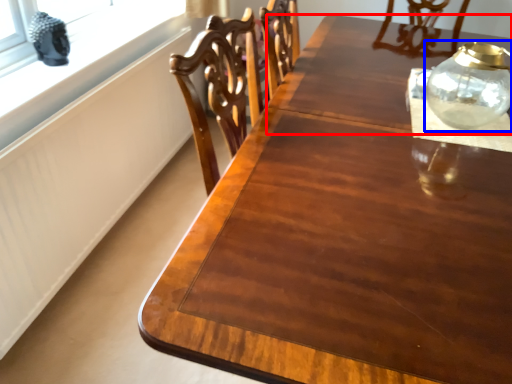
Question: Which object appears farthest to the camera in this image, round table (highlighted by a red box) or glass vase (highlighted by a blue box)?

Choices:
 (A) round table
 (B) glass vase

Answer: (A)